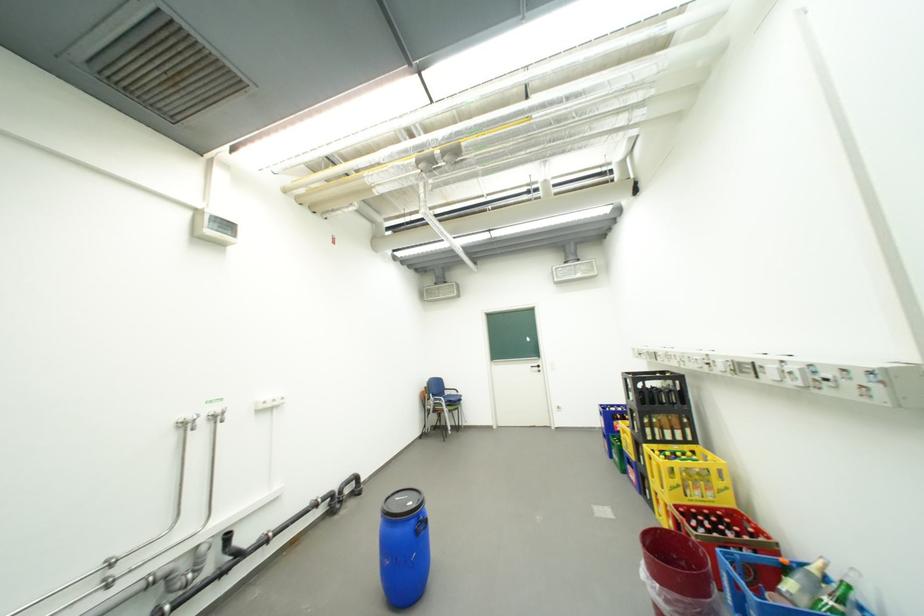
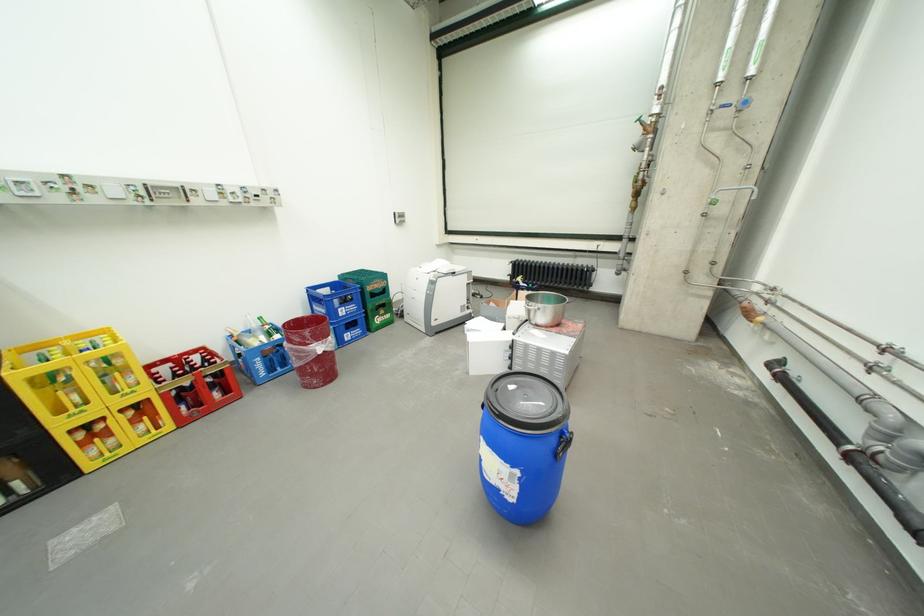
Locate, in the second image, the point that corresponds to pixel 700 546 in the first image.

(297, 328)